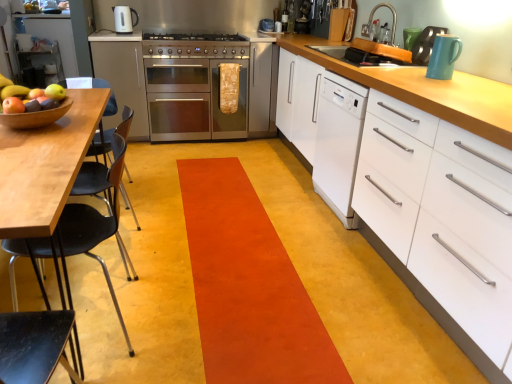
Identify the location of vacant area located to the right-hand side of black plastic chair at left. The width and height of the screenshot is (512, 384). (187, 314).